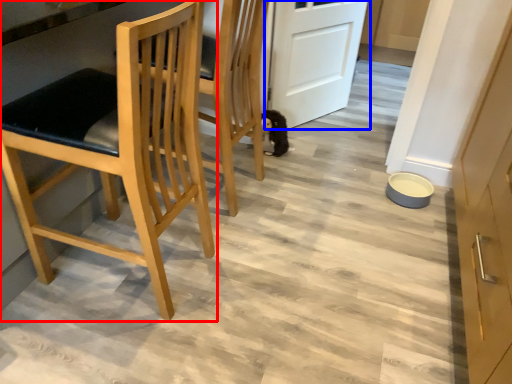
Question: Among these objects, which one is farthest to the camera, chair (highlighted by a red box) or door (highlighted by a blue box)?

Choices:
 (A) chair
 (B) door

Answer: (B)